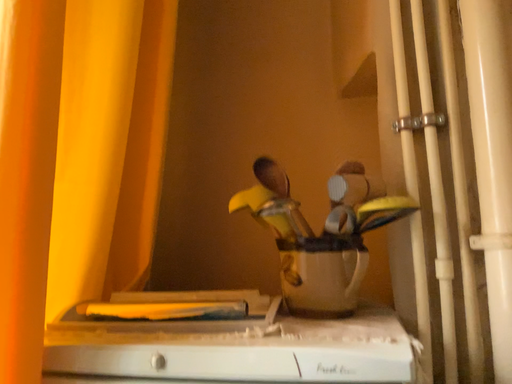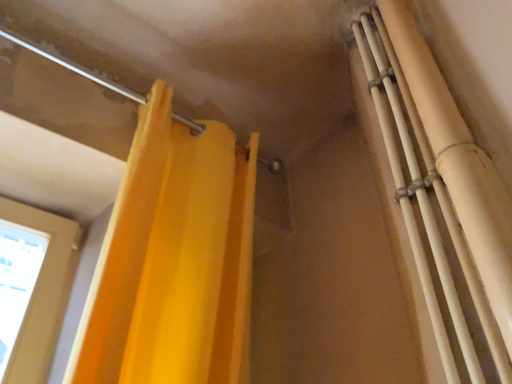
Question: Which way did the camera rotate in the video?

Choices:
 (A) rotated upward
 (B) rotated downward

Answer: (A)